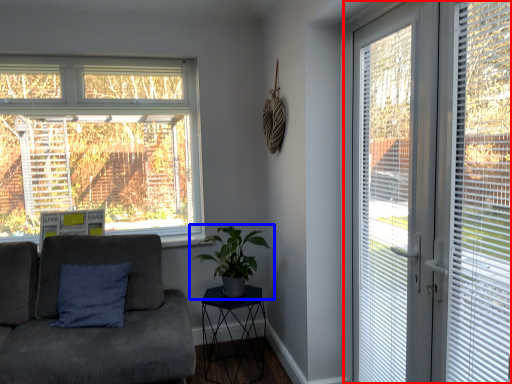
Question: Among these objects, which one is farthest to the camera, window (highlighted by a red box) or houseplant (highlighted by a blue box)?

Choices:
 (A) window
 (B) houseplant

Answer: (B)